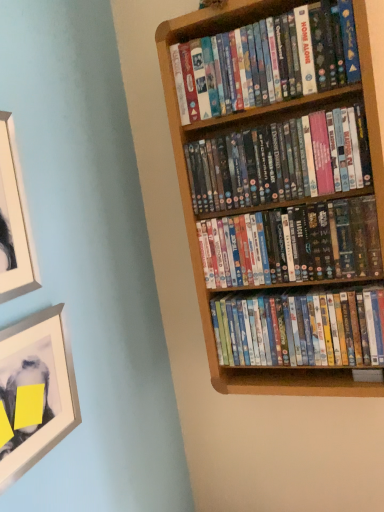
What are the coordinates of `matte plastic dvds at upper right, which is the second book from top to bottom` in the screenshot? It's located at click(x=280, y=161).

Describe the element at coordinates (243, 123) in the screenshot. I see `light brown wood bookcase at upper right` at that location.

What do you see at coordinates (14, 221) in the screenshot? This screenshot has width=384, height=512. I see `white matte picture frame at upper left, arranged as the second picture frame when ordered from the bottom` at bounding box center [14, 221].

What is the approximate height of multicolored plastic dvds at center, which appears as the 3th book when viewed from the top?

It is 7.82 inches.

Locate an element on the screen. This screenshot has height=512, width=384. matte plastic dvds at upper right, which is the second book from top to bottom is located at coordinates (280, 161).

Who is shorter, matte cardboard book at upper right, the fourth book ordered from the bottom, or multicolored plastic dvds at center, which appears as the 3th book when viewed from the top?

multicolored plastic dvds at center, which appears as the 3th book when viewed from the top, is shorter.

Which is correct: matte cardboard book at upper right, the 1th book from the top, is inside multicolored plastic dvds at center, which appears as the 3th book when viewed from the top, or outside of it?

matte cardboard book at upper right, the 1th book from the top, cannot be found inside multicolored plastic dvds at center, which appears as the 3th book when viewed from the top.

How many degrees apart are the facing directions of matte cardboard book at upper right, the fourth book ordered from the bottom, and multicolored plastic dvds at center, the 2th book from the bottom?

They differ by 0.00131 degrees in their facing directions.

How far apart are matte cardboard book at upper right, the fourth book ordered from the bottom, and multicolored plastic dvds at center, which appears as the 3th book when viewed from the top?

matte cardboard book at upper right, the fourth book ordered from the bottom, is 13.92 inches from multicolored plastic dvds at center, which appears as the 3th book when viewed from the top.

Is light brown wood bookcase at upper right surrounding white matte picture frame at upper left, arranged as the second picture frame when ordered from the bottom?

No, white matte picture frame at upper left, arranged as the second picture frame when ordered from the bottom, is not surrounded by light brown wood bookcase at upper right.

Does light brown wood bookcase at upper right have a lesser height compared to white matte picture frame at upper left, arranged as the 1th picture frame when viewed from the top?

No.

Is light brown wood bookcase at upper right placed right next to white matte picture frame at upper left, arranged as the second picture frame when ordered from the bottom?

There is a gap between light brown wood bookcase at upper right and white matte picture frame at upper left, arranged as the second picture frame when ordered from the bottom.

How different are the orientations of light brown wood bookcase at upper right and white matte picture frame at upper left, arranged as the second picture frame when ordered from the bottom, in degrees?

The facing directions of light brown wood bookcase at upper right and white matte picture frame at upper left, arranged as the second picture frame when ordered from the bottom, are 89.3 degrees apart.

Is point (358, 23) more distant than point (253, 347)?

No, (358, 23) is in front of (253, 347).

From a real-world perspective, is light brown wood bookcase at upper right physically located above or below multicolored plastic dvds at center, the first book when ordered from bottom to top?

light brown wood bookcase at upper right is above multicolored plastic dvds at center, the first book when ordered from bottom to top.

You are a GUI agent. You are given a task and a screenshot of the screen. Output one action in this format:
    pyautogui.click(x=<x>, y=<y>)
    Task: Click on the 2nd book directly beneath the light brown wood bookcase at upper right (from a real-world perspective)
    The image size is (384, 512).
    Given the screenshot: What is the action you would take?
    pyautogui.click(x=301, y=329)

Considering their positions, is light brown wood bookcase at upper right located in front of or behind multicolored plastic dvds at center, the first book when ordered from bottom to top?

light brown wood bookcase at upper right is positioned closer to the viewer than multicolored plastic dvds at center, the first book when ordered from bottom to top.

The width and height of the screenshot is (384, 512). Identify the location of the 1st book positioned below the matte cardboard book at upper right, the 1th book from the top (from a real-world perspective). (280, 161).

Is matte plastic dvds at upper right, which ranks as the 3th book in bottom-to-top order, wider or thinner than matte cardboard book at upper right, the fourth book ordered from the bottom?

Clearly, matte plastic dvds at upper right, which ranks as the 3th book in bottom-to-top order, has less width compared to matte cardboard book at upper right, the fourth book ordered from the bottom.

From the picture: Is matte plastic dvds at upper right, which is the second book from top to bottom, not near matte cardboard book at upper right, the fourth book ordered from the bottom?

No, matte plastic dvds at upper right, which is the second book from top to bottom, is in close proximity to matte cardboard book at upper right, the fourth book ordered from the bottom.

From a real-world perspective, relative to matte cardboard book at upper right, the fourth book ordered from the bottom, is matte plastic dvds at upper right, which ranks as the 3th book in bottom-to-top order, vertically above or below?

matte plastic dvds at upper right, which ranks as the 3th book in bottom-to-top order, is situated lower than matte cardboard book at upper right, the fourth book ordered from the bottom, in the real world.

From a real-world perspective, is matte cardboard book at upper right, the 1th book from the top, positioned above or below metallic silver picture frame at lower left, which is the 1th picture frame in bottom-to-top order?

matte cardboard book at upper right, the 1th book from the top, is situated higher than metallic silver picture frame at lower left, which is the 1th picture frame in bottom-to-top order, in the real world.

Is matte cardboard book at upper right, the 1th book from the top, spatially inside metallic silver picture frame at lower left, which is the 1th picture frame in bottom-to-top order, or outside of it?

matte cardboard book at upper right, the 1th book from the top, lies outside metallic silver picture frame at lower left, which is the 1th picture frame in bottom-to-top order.

Which is less distant, (299,67) or (15,473)?

The point (15,473) is closer.

Is matte cardboard book at upper right, the fourth book ordered from the bottom, next to metallic silver picture frame at lower left, which is the 1th picture frame in bottom-to-top order, and touching it?

No, matte cardboard book at upper right, the fourth book ordered from the bottom, is not next to metallic silver picture frame at lower left, which is the 1th picture frame in bottom-to-top order.

Which of these two, multicolored plastic dvds at center, which appears as the 3th book when viewed from the top, or multicolored plastic dvds at center, arranged as the fourth book when viewed from the top, stands taller?

Standing taller between the two is multicolored plastic dvds at center, arranged as the fourth book when viewed from the top.

The width and height of the screenshot is (384, 512). In the image, there is a multicolored plastic dvds at center, the 2th book from the bottom. Identify the location of book below it (from a real-world perspective). click(x=301, y=329).

Is multicolored plastic dvds at center, which appears as the 3th book when viewed from the top, to the left or to the right of multicolored plastic dvds at center, the first book when ordered from bottom to top, in the image?

In the image, multicolored plastic dvds at center, which appears as the 3th book when viewed from the top, appears on the left side of multicolored plastic dvds at center, the first book when ordered from bottom to top.

In terms of size, does multicolored plastic dvds at center, arranged as the fourth book when viewed from the top, appear bigger or smaller than white matte picture frame at upper left, arranged as the second picture frame when ordered from the bottom?

In the image, multicolored plastic dvds at center, arranged as the fourth book when viewed from the top, appears to be larger than white matte picture frame at upper left, arranged as the second picture frame when ordered from the bottom.

Would you consider multicolored plastic dvds at center, the first book when ordered from bottom to top, to be distant from white matte picture frame at upper left, arranged as the second picture frame when ordered from the bottom?

No, multicolored plastic dvds at center, the first book when ordered from bottom to top, is in close proximity to white matte picture frame at upper left, arranged as the second picture frame when ordered from the bottom.

From a real-world perspective, is multicolored plastic dvds at center, the first book when ordered from bottom to top, beneath white matte picture frame at upper left, arranged as the 1th picture frame when viewed from the top?

Yes.

The width and height of the screenshot is (384, 512). What are the coordinates of `book that is the 2nd object located behind the matte cardboard book at upper right, the 1th book from the top` in the screenshot? It's located at (292, 244).

Which picture frame is the 2nd one when counting from the left side of the light brown wood bookcase at upper right? Please provide its 2D coordinates.

[(14, 221)]

Looking at the image, which one is located further to multicolored plastic dvds at center, which appears as the 3th book when viewed from the top, light brown wood bookcase at upper right or multicolored plastic dvds at center, arranged as the fourth book when viewed from the top?

light brown wood bookcase at upper right.

Considering their positions, is white matte picture frame at upper left, arranged as the 1th picture frame when viewed from the top, positioned closer to matte plastic dvds at upper right, which ranks as the 3th book in bottom-to-top order, than multicolored plastic dvds at center, which appears as the 3th book when viewed from the top?

multicolored plastic dvds at center, which appears as the 3th book when viewed from the top, is closer to matte plastic dvds at upper right, which ranks as the 3th book in bottom-to-top order.

Based on their spatial positions, is metallic silver picture frame at lower left, placed as the 2th picture frame when sorted from top to bottom, or light brown wood bookcase at upper right closer to matte plastic dvds at upper right, which is the second book from top to bottom?

The object closer to matte plastic dvds at upper right, which is the second book from top to bottom, is light brown wood bookcase at upper right.

Estimate the real-world distances between objects in this image. Which object is further from multicolored plastic dvds at center, arranged as the fourth book when viewed from the top, matte plastic dvds at upper right, which is the second book from top to bottom, or white matte picture frame at upper left, arranged as the second picture frame when ordered from the bottom?

Among the two, white matte picture frame at upper left, arranged as the second picture frame when ordered from the bottom, is located further to multicolored plastic dvds at center, arranged as the fourth book when viewed from the top.

Considering their positions, is matte cardboard book at upper right, the 1th book from the top, positioned closer to multicolored plastic dvds at center, arranged as the fourth book when viewed from the top, than multicolored plastic dvds at center, the 2th book from the bottom?

Based on the image, multicolored plastic dvds at center, the 2th book from the bottom, appears to be nearer to multicolored plastic dvds at center, arranged as the fourth book when viewed from the top.

From the image, which object appears to be nearer to matte cardboard book at upper right, the fourth book ordered from the bottom, matte plastic dvds at upper right, which is the second book from top to bottom, or multicolored plastic dvds at center, arranged as the fourth book when viewed from the top?

Based on the image, matte plastic dvds at upper right, which is the second book from top to bottom, appears to be nearer to matte cardboard book at upper right, the fourth book ordered from the bottom.

From the image, which object appears to be farther from white matte picture frame at upper left, arranged as the 1th picture frame when viewed from the top, multicolored plastic dvds at center, arranged as the fourth book when viewed from the top, or metallic silver picture frame at lower left, placed as the 2th picture frame when sorted from top to bottom?

Based on the image, multicolored plastic dvds at center, arranged as the fourth book when viewed from the top, appears to be further to white matte picture frame at upper left, arranged as the 1th picture frame when viewed from the top.

Based on their spatial positions, is metallic silver picture frame at lower left, which is the 1th picture frame in bottom-to-top order, or multicolored plastic dvds at center, the first book when ordered from bottom to top, further from matte cardboard book at upper right, the fourth book ordered from the bottom?

metallic silver picture frame at lower left, which is the 1th picture frame in bottom-to-top order, is positioned further to the anchor matte cardboard book at upper right, the fourth book ordered from the bottom.

Where is `book between light brown wood bookcase at upper right and multicolored plastic dvds at center, arranged as the fourth book when viewed from the top, from top to bottom`? book between light brown wood bookcase at upper right and multicolored plastic dvds at center, arranged as the fourth book when viewed from the top, from top to bottom is located at coordinates (292, 244).

The height and width of the screenshot is (512, 384). I want to click on picture frame between white matte picture frame at upper left, arranged as the 1th picture frame when viewed from the top, and light brown wood bookcase at upper right, so click(x=35, y=391).

This screenshot has height=512, width=384. Identify the location of book that lies between matte cardboard book at upper right, the 1th book from the top, and light brown wood bookcase at upper right from top to bottom. (280, 161).

Where is `bookcase between matte plastic dvds at upper right, which is the second book from top to bottom, and multicolored plastic dvds at center, arranged as the fourth book when viewed from the top, in the up-down direction`? The height and width of the screenshot is (512, 384). bookcase between matte plastic dvds at upper right, which is the second book from top to bottom, and multicolored plastic dvds at center, arranged as the fourth book when viewed from the top, in the up-down direction is located at coordinates pyautogui.click(x=243, y=123).